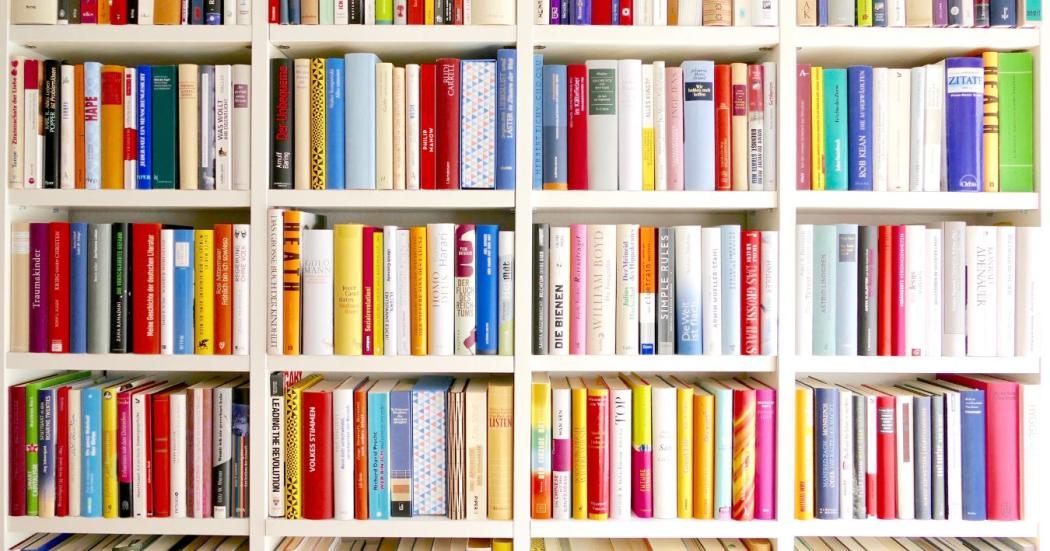
Image resolution: width=1050 pixels, height=551 pixels. Identify the location of book with yellow cover. (819, 129), (649, 154), (207, 299), (350, 294), (379, 294), (810, 446), (685, 452), (582, 437), (105, 458).